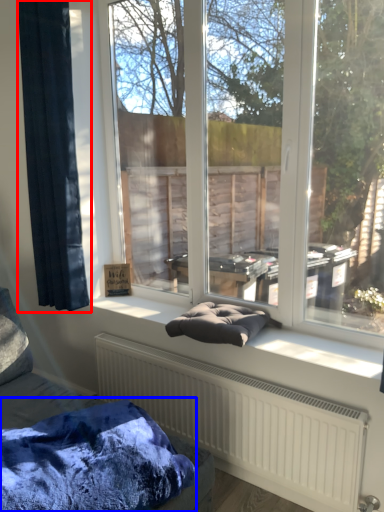
Question: Which object is closer to the camera taking this photo, curtain (highlighted by a red box) or blanket (highlighted by a blue box)?

Choices:
 (A) curtain
 (B) blanket

Answer: (B)